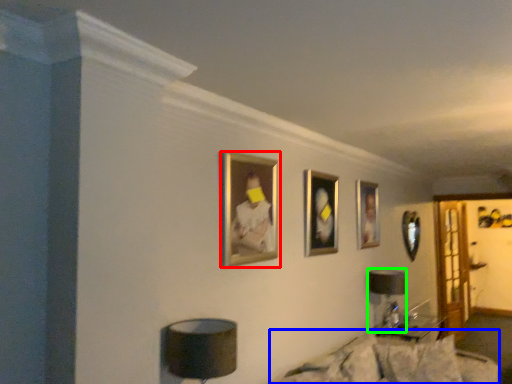
Question: Which object is the closest to the picture frame (highlighted by a red box)? Choose among these: couch (highlighted by a blue box) or table lamp (highlighted by a green box).

Choices:
 (A) couch
 (B) table lamp

Answer: (A)